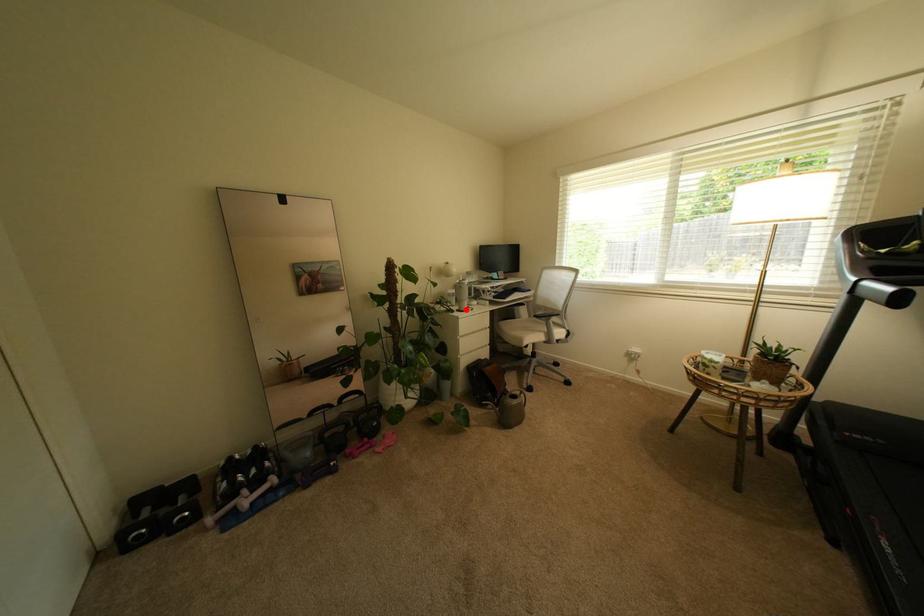
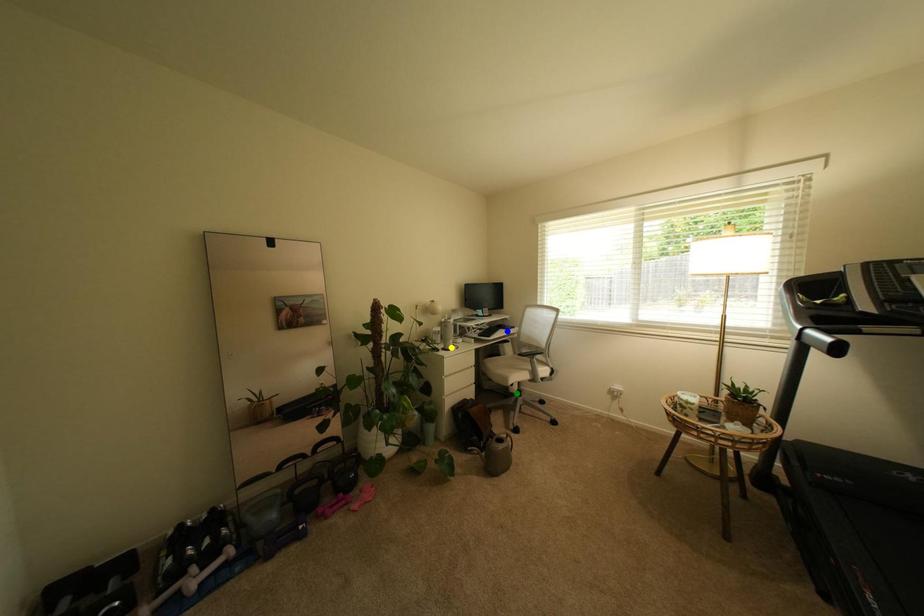
Question: I am providing you with two images of the same scene from different viewpoints. A red point is marked on the first image. You are given multiple points on the second image. Which point in image 2 represents the same 3d spot as the red point in image 1?

Choices:
 (A) blue point
 (B) yellow point
 (C) green point

Answer: (B)